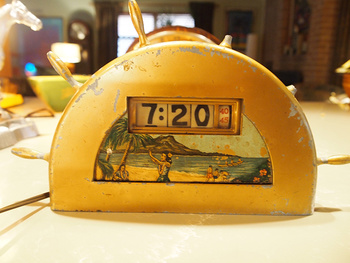
This screenshot has height=263, width=350. I want to click on red facebrick wall, so click(319, 43).